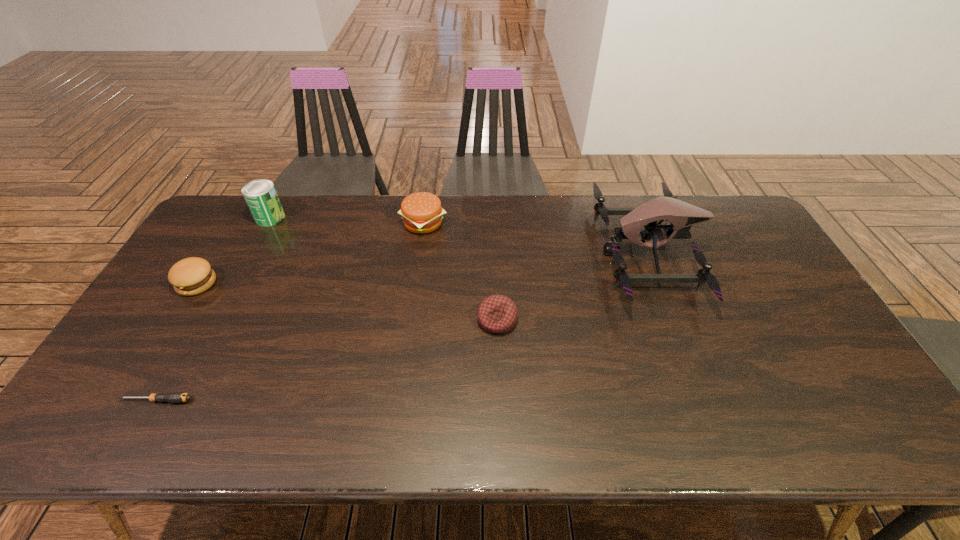
Where is `hamburger that is at the far edge`? This screenshot has width=960, height=540. hamburger that is at the far edge is located at coordinates (421, 212).

At what (x,y) coordinates should I click in order to perform the action: click on can situated at the left edge. Please return your answer as a coordinate pair (x, y). This screenshot has height=540, width=960. Looking at the image, I should click on (261, 197).

In order to click on hamburger located at the left edge in this screenshot , I will do `click(190, 276)`.

The height and width of the screenshot is (540, 960). I want to click on screwdriver located in the left edge section of the desktop, so tap(173, 397).

Image resolution: width=960 pixels, height=540 pixels. Find the location of `object that is at the far left corner`. object that is at the far left corner is located at coordinates (261, 197).

Where is `free point at the far edge`? This screenshot has height=540, width=960. free point at the far edge is located at coordinates (468, 221).

Locate an element on the screen. vacant space at the near edge is located at coordinates (667, 436).

In the image, there is a desktop. Where is `free region at the right edge`? free region at the right edge is located at coordinates (729, 244).

At what (x,y) coordinates should I click in order to perform the action: click on vacant space at the far left corner of the desktop. Please return your answer as a coordinate pair (x, y). This screenshot has width=960, height=540. Looking at the image, I should click on (247, 219).

In the image, there is a desktop. Where is `vacant space at the far right corner`? The image size is (960, 540). vacant space at the far right corner is located at coordinates (717, 220).